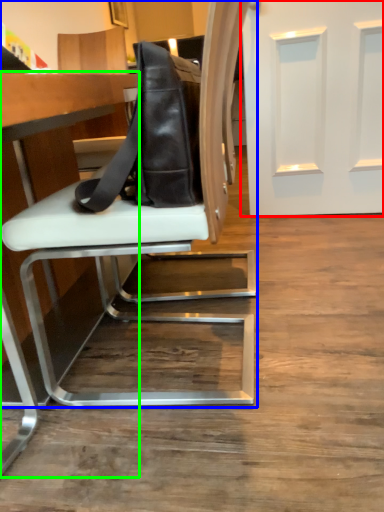
Question: Based on their relative distances, which object is nearer to door (highlighted by a red box)? Choose from chair (highlighted by a blue box) and table (highlighted by a green box).

Choices:
 (A) chair
 (B) table

Answer: (A)